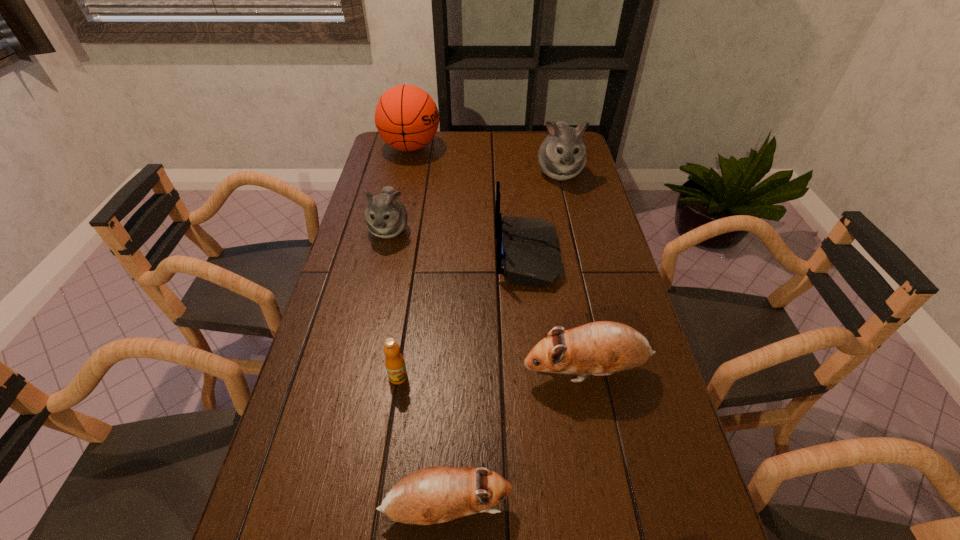
You are a GUI agent. You are given a task and a screenshot of the screen. Output one action in this format:
    pyautogui.click(x=<x>, y=<y>)
    Task: Click on the basketball
    The image size is (960, 540).
    Given the screenshot: What is the action you would take?
    pyautogui.click(x=406, y=117)

Where is `the bigger white hamster`? This screenshot has width=960, height=540. the bigger white hamster is located at coordinates (562, 155).

You are a GUI agent. You are given a task and a screenshot of the screen. Output one action in this format:
    pyautogui.click(x=<x>, y=<y>)
    Task: Click on the tallest hamster
    
    Given the screenshot: What is the action you would take?
    pyautogui.click(x=562, y=155)

The image size is (960, 540). I want to click on black router, so click(527, 250).

The image size is (960, 540). Identify the location of the smaller white hamster. (385, 217).

The height and width of the screenshot is (540, 960). I want to click on the nearer white hamster, so click(x=385, y=217).

Locate an element on the screen. The image size is (960, 540). the second nearest hamster is located at coordinates (601, 348).

Where is `the right brown hamster`? Image resolution: width=960 pixels, height=540 pixels. the right brown hamster is located at coordinates (601, 348).

Where is `orange juice`? This screenshot has height=540, width=960. orange juice is located at coordinates (394, 362).

Locate an element on the screen. This screenshot has width=960, height=540. the smaller brown hamster is located at coordinates (431, 495).